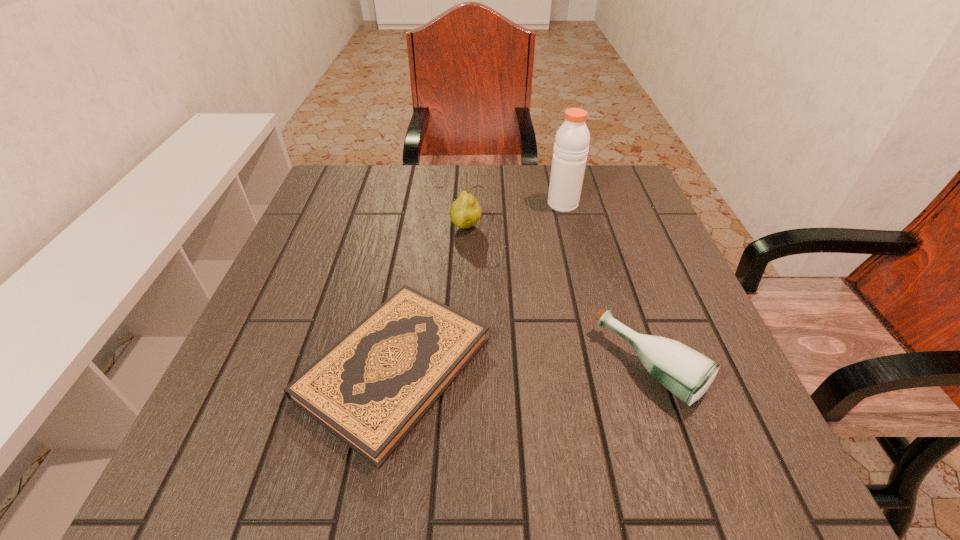
The image size is (960, 540). I want to click on free space that satisfies the following two spatial constraints: 1. on the back side of the third tallest object; 2. on the right side of the hardback book, so click(395, 367).